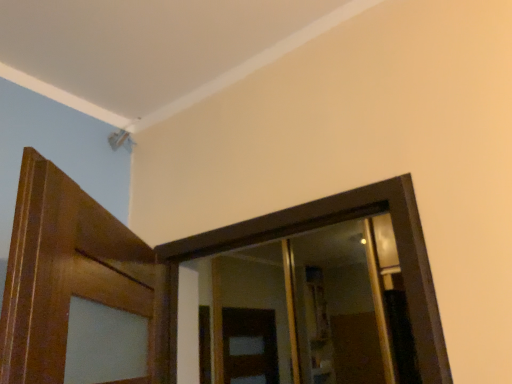
In order to click on gold-framed mirror at center in this screenshot , I will do pyautogui.click(x=303, y=308).

This screenshot has height=384, width=512. What do you see at coordinates (303, 308) in the screenshot?
I see `gold-framed mirror at center` at bounding box center [303, 308].

At what (x,y) coordinates should I click in order to perform the action: click on gold-framed mirror at center. Please return your answer as a coordinate pair (x, y). The width and height of the screenshot is (512, 384). Looking at the image, I should click on (x=303, y=308).